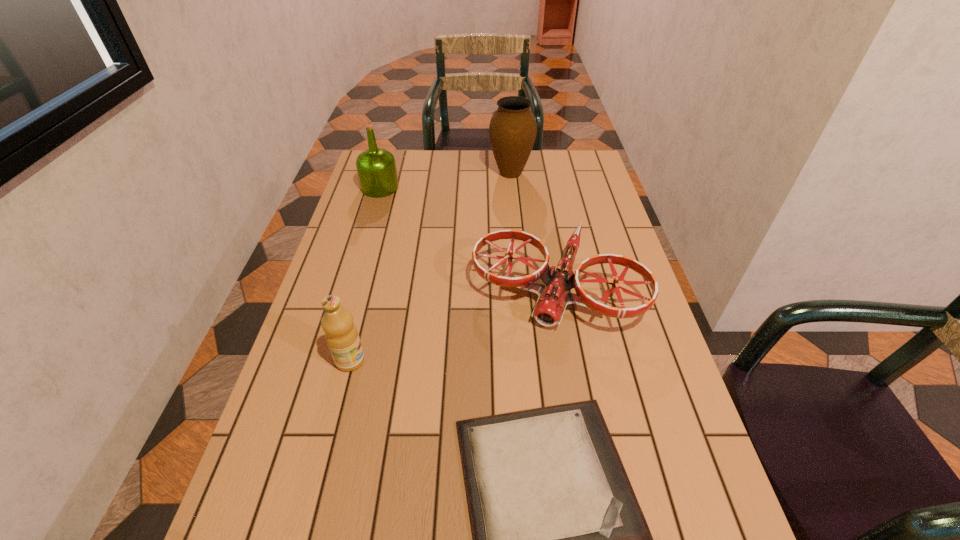
Locate an element on the screen. The image size is (960, 540). olive oil that is at the far edge is located at coordinates (376, 167).

Find the location of a particular element. This screenshot has width=960, height=540. object present at the right edge is located at coordinates (553, 298).

Where is `object located in the far left corner section of the desktop`? object located in the far left corner section of the desktop is located at coordinates (376, 167).

Where is `free space at the far edge`? The height and width of the screenshot is (540, 960). free space at the far edge is located at coordinates (453, 168).

Locate an element on the screen. This screenshot has width=960, height=540. vacant space at the left edge of the desktop is located at coordinates (352, 310).

In the image, there is a desktop. Where is `vacant space at the right edge`? This screenshot has height=540, width=960. vacant space at the right edge is located at coordinates (712, 511).

This screenshot has width=960, height=540. Identify the location of free spot between the fourth farthest object and the urn. (430, 267).

At what (x,y) coordinates should I click in order to perform the action: click on free space between the fourth farthest object and the second shortest object. Please return your answer as a coordinate pair (x, y). Looking at the image, I should click on pos(452,322).

In order to click on vacant area between the urn and the second shortest object in this screenshot , I will do `click(533, 228)`.

At what (x,y) coordinates should I click in order to perform the action: click on free space between the fourth farthest object and the third nearest object. Please return your answer as a coordinate pair (x, y). Looking at the image, I should click on (452, 322).